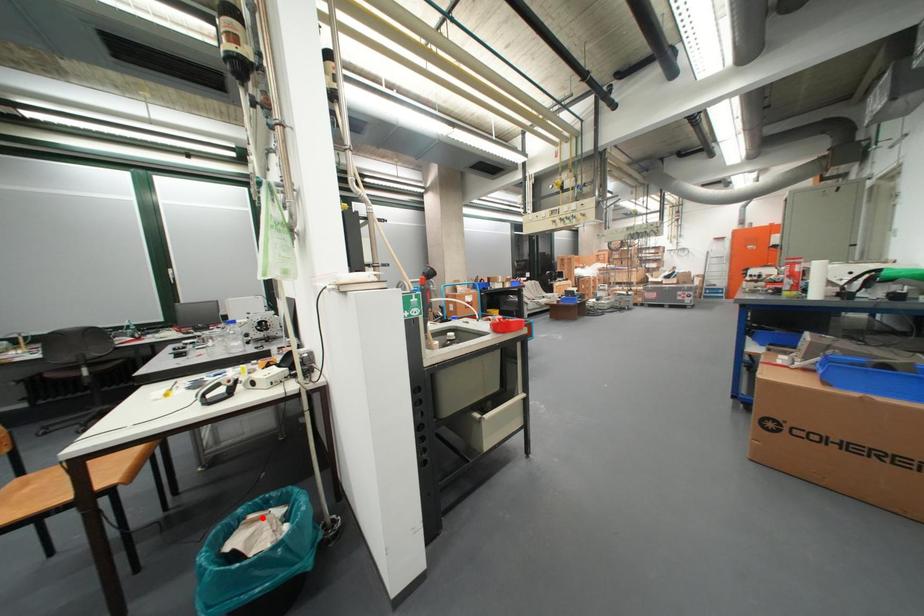
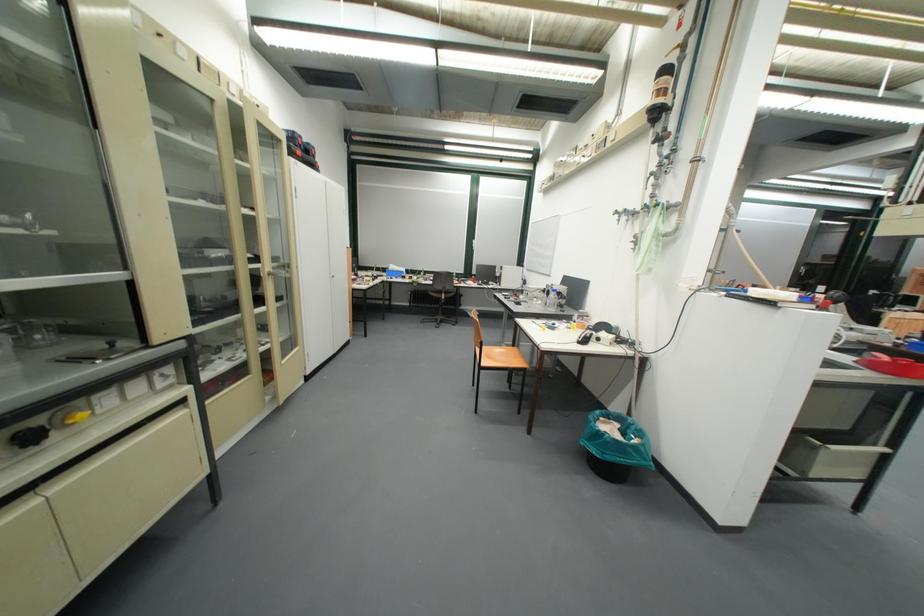
Question: A red point is marked in image1. In image2, is the corresponding 3D point closer to the camera or farther? Reply with the corresponding letter.

Choices:
 (A) The corresponding 3D point is closer.
 (B) The corresponding 3D point is farther.

Answer: (A)